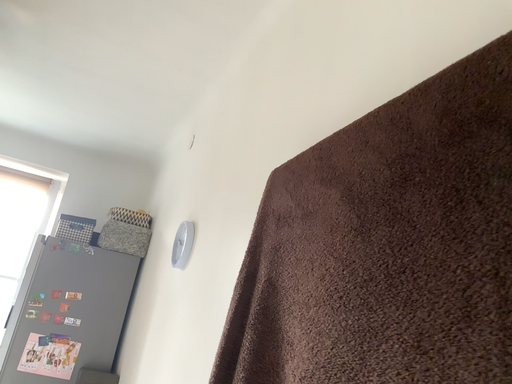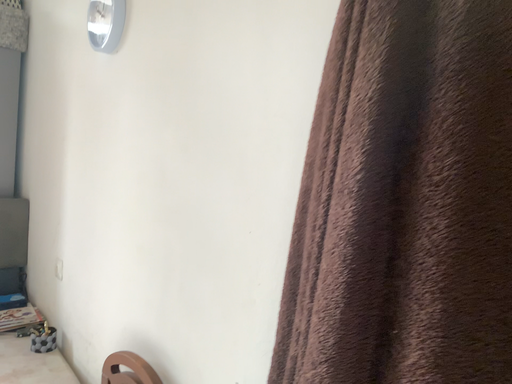
Question: Which way did the camera rotate in the video?

Choices:
 (A) rotated left
 (B) rotated right

Answer: (B)